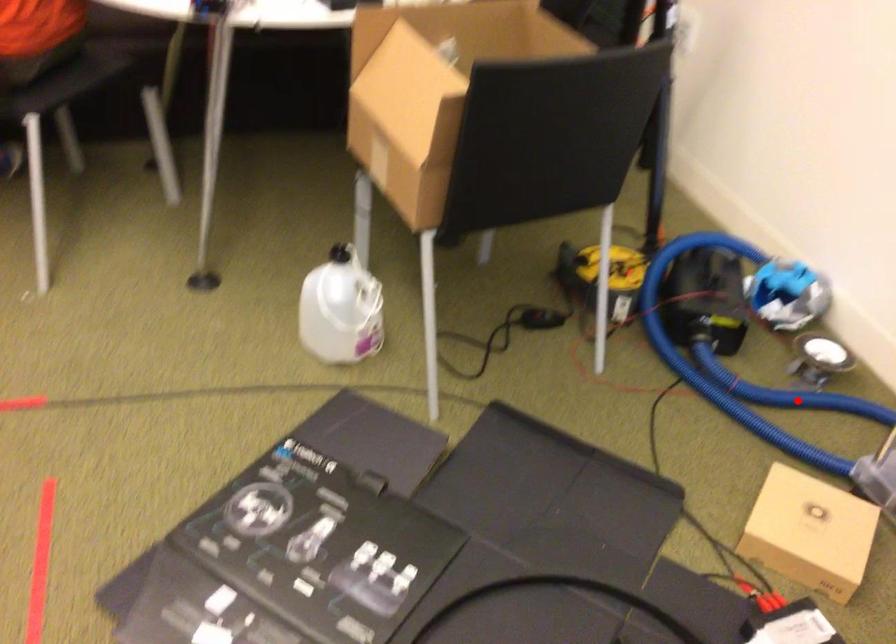
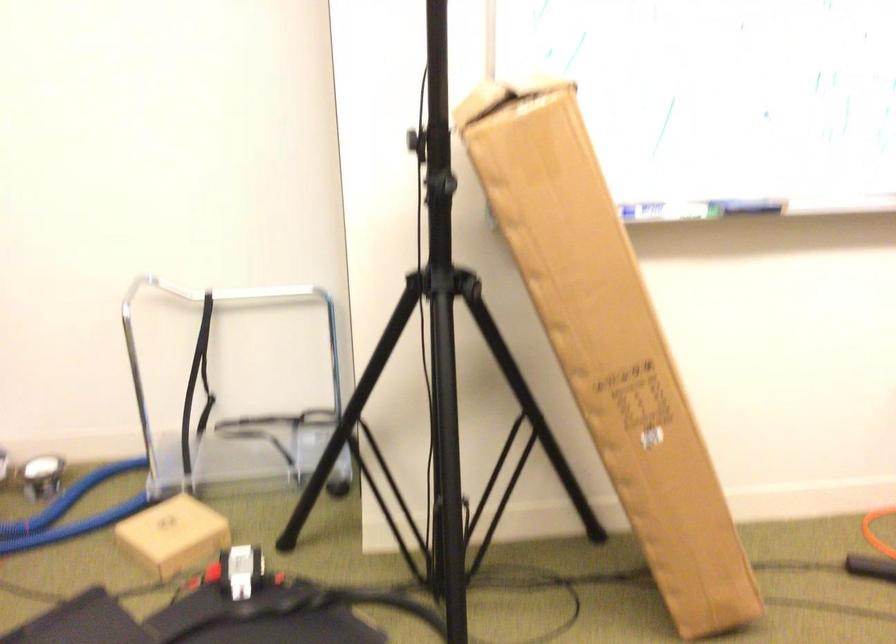
Question: I am providing you with two images of the same scene from different viewpoints. A red point is shown in image1. For the corresponding object point in image2, is it positioned nearer or farther from the camera?

Choices:
 (A) Nearer
 (B) Farther

Answer: (B)